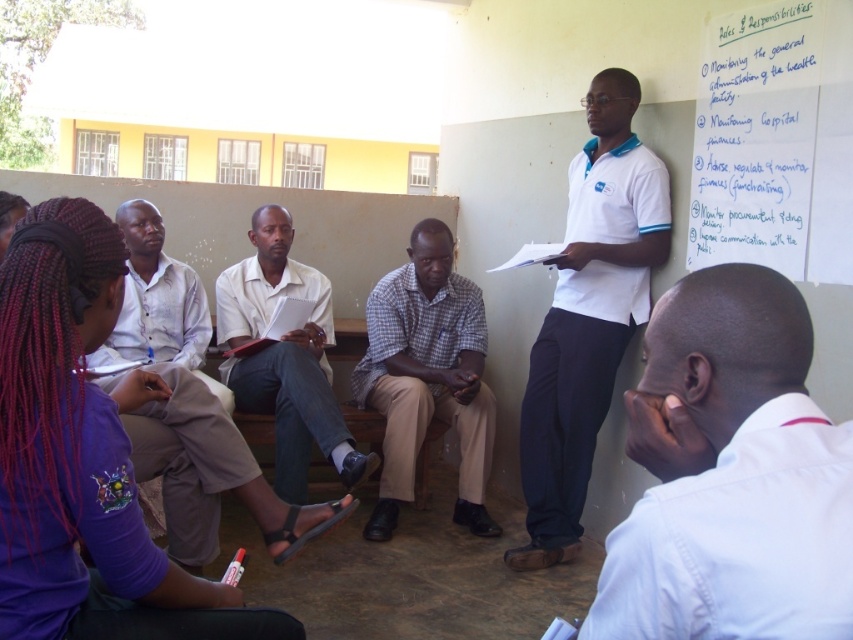
You are a photographer trying to capture a clear shot of both the white shirt at upper right and the white cotton shirt at upper right. Since you want to ensure both shirts are fully visible in the frame, which shirt should you focus on first to avoid cropping the taller one out?

The white cotton shirt at upper right is taller than the white shirt at upper right. To avoid cropping the taller one, you should focus on the white cotton shirt at upper right first to ensure it fits within the frame.